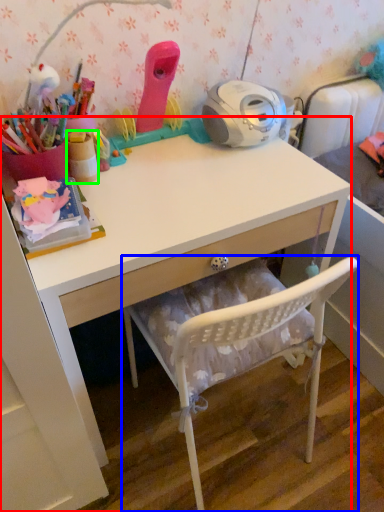
Question: Based on their relative distances, which object is nearer to desk (highlighted by a red box)? Choose from chair (highlighted by a blue box) and stationery (highlighted by a green box).

Choices:
 (A) chair
 (B) stationery

Answer: (A)